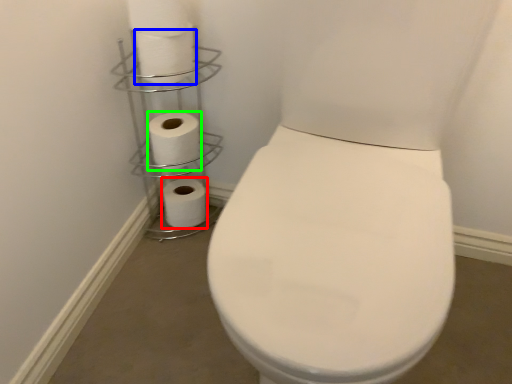
Question: Which object is positioned closest to toilet paper (highlighted by a red box)? Select from toilet paper (highlighted by a blue box) and toilet paper (highlighted by a green box).

Choices:
 (A) toilet paper
 (B) toilet paper

Answer: (B)